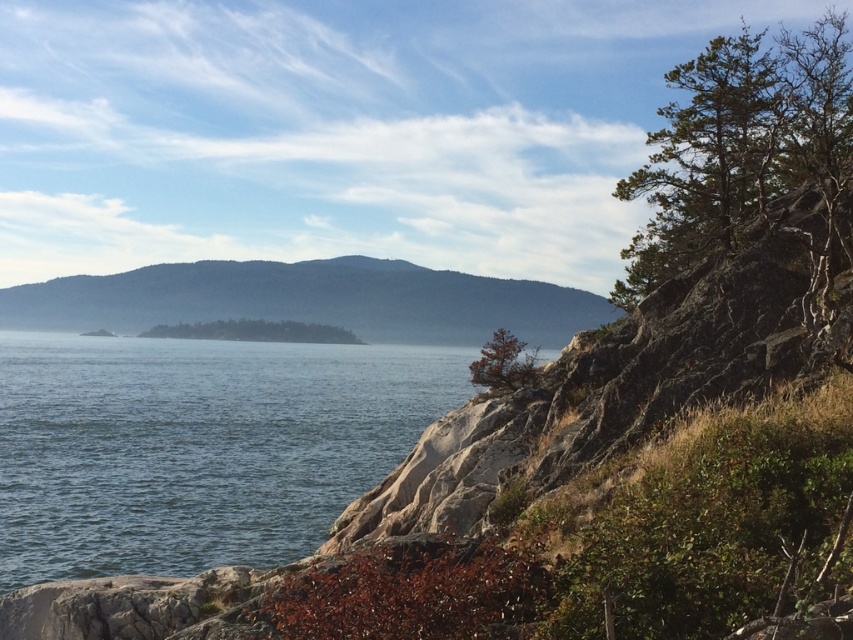
You are a kayaker planning to paddle from the clear water at lower left to the green leafy tree at center. Based on the distance between them, can you estimate how long it would take if you paddle at a steady speed of 2 mph?

The clear water at lower left and green leafy tree at center are 374.73 feet apart. Converting that to miles, it is approximately 0.071 miles. At a steady speed of 2 mph, it would take roughly 2.13 minutes to paddle the distance.

You are standing at the point with coordinates point [292,339] and want to walk towards the point with coordinates point [235,470]. Based on the scene description, which direction should you move relative to your current position?

You should move forward because point [235,470] is in front of point [292,339] according to the coordinates provided.